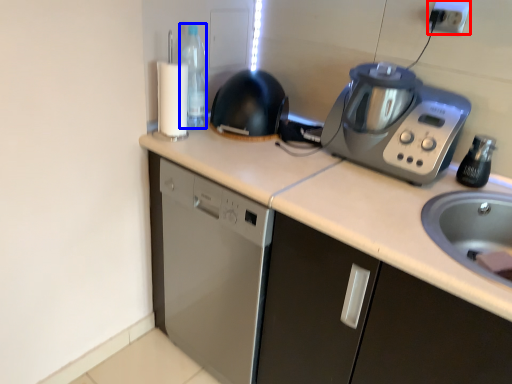
Question: Which of the following is the farthest to the observer, electric outlet (highlighted by a red box) or bottle (highlighted by a blue box)?

Choices:
 (A) electric outlet
 (B) bottle

Answer: (B)